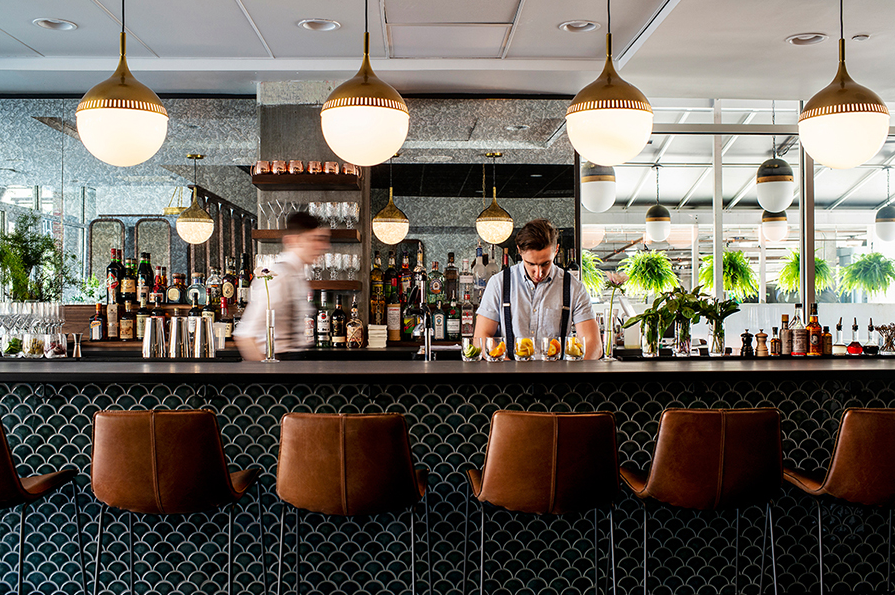
This screenshot has width=895, height=595. I want to click on hanging lights, so click(101, 134), click(342, 131), click(599, 125), click(839, 123), click(770, 187), click(597, 186), click(489, 234), click(391, 236), click(201, 228).